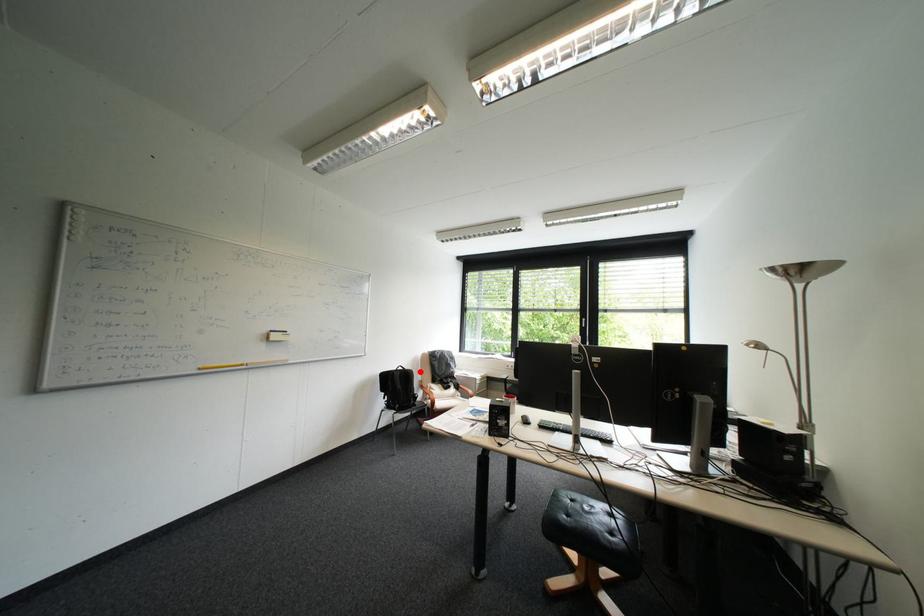
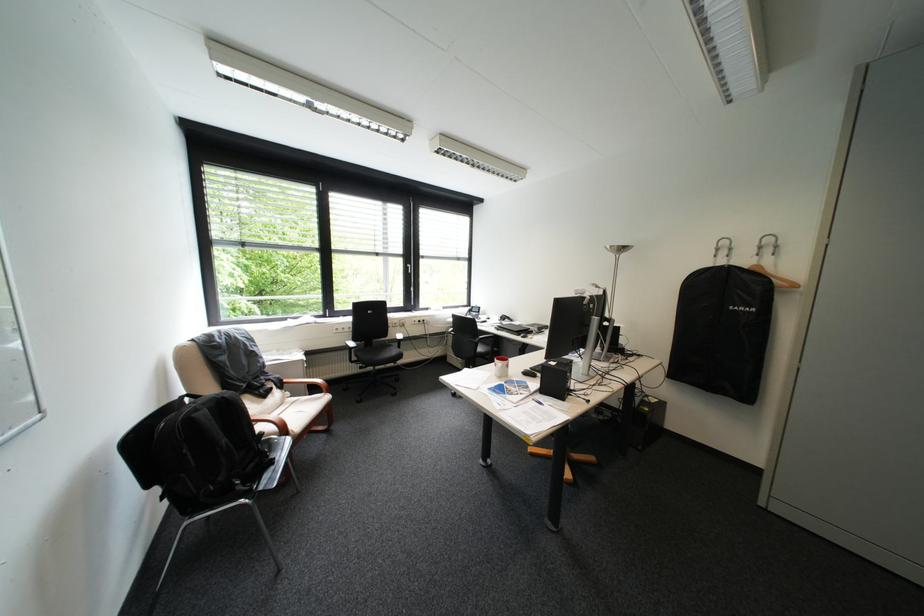
The point at the highlighted location is marked in the first image. Where is the corresponding point in the second image?

(236, 398)